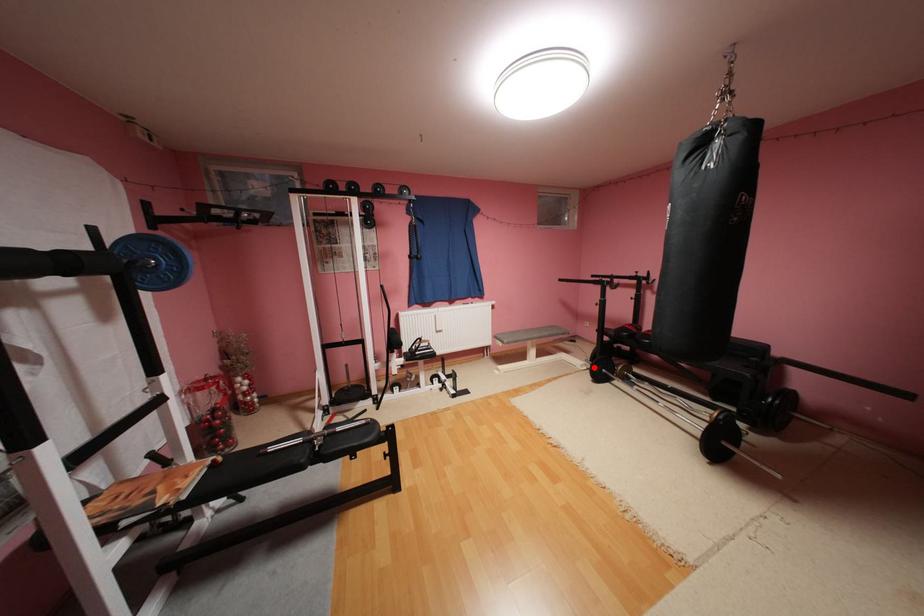
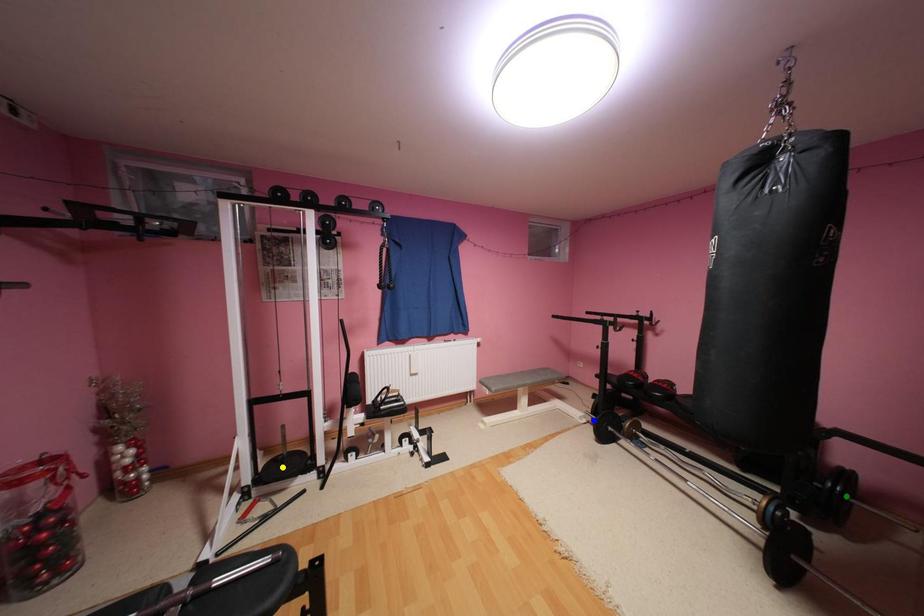
Question: I am providing you with two images of the same scene from different viewpoints. A red point is marked on the first image. You are given multiple points on the second image. Which point in image 2 represents the same 3d spot as the red point in image 1?

Choices:
 (A) blue point
 (B) yellow point
 (C) green point

Answer: (A)